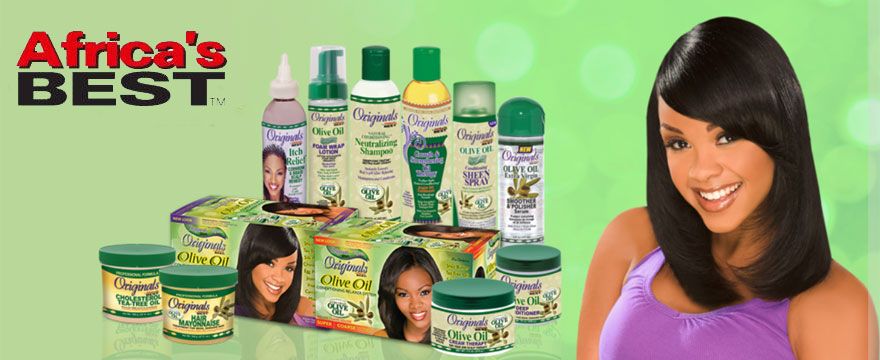
What are the coordinates of `jars` in the screenshot? It's located at (114, 273), (217, 302), (455, 333), (539, 267).